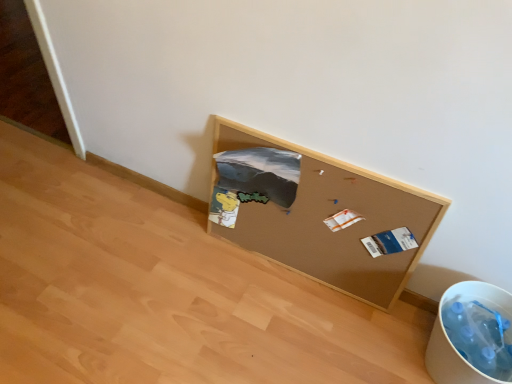
Question: Considering the positions of white plastic recycling bin at lower right and corkboard at lower right in the image, is white plastic recycling bin at lower right taller or shorter than corkboard at lower right?

Choices:
 (A) tall
 (B) short

Answer: (B)

Question: Visually, is white plastic recycling bin at lower right positioned to the left or to the right of corkboard at lower right?

Choices:
 (A) left
 (B) right

Answer: (B)

Question: Looking at the image, does white plastic recycling bin at lower right seem bigger or smaller compared to corkboard at lower right?

Choices:
 (A) small
 (B) big

Answer: (A)

Question: From a real-world perspective, is corkboard at lower right above or below white plastic recycling bin at lower right?

Choices:
 (A) above
 (B) below

Answer: (A)

Question: Is corkboard at lower right situated inside white plastic recycling bin at lower right or outside?

Choices:
 (A) outside
 (B) inside

Answer: (A)

Question: In the image, is corkboard at lower right on the left side or the right side of white plastic recycling bin at lower right?

Choices:
 (A) right
 (B) left

Answer: (B)

Question: Considering the positions of corkboard at lower right and white plastic recycling bin at lower right in the image, is corkboard at lower right bigger or smaller than white plastic recycling bin at lower right?

Choices:
 (A) small
 (B) big

Answer: (B)